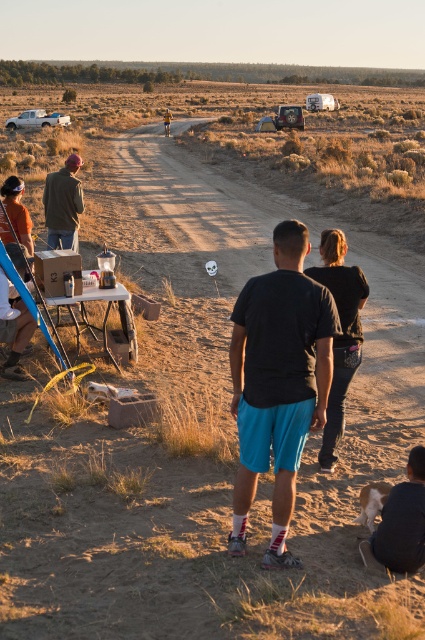
Between wooden picnic table at lower left and white matte truck at left, which one is positioned lower?

wooden picnic table at lower left

Looking at this image, is wooden picnic table at lower left taller than white matte truck at left?

No.

From the picture: Measure the distance between wooden picnic table at lower left and camera.

A distance of 22.67 feet exists between wooden picnic table at lower left and camera.

This screenshot has height=640, width=425. Find the location of `wooden picnic table at lower left`. wooden picnic table at lower left is located at coordinates (104, 314).

Does point (48, 211) lie behind point (28, 116)?

No, (48, 211) is closer to viewer.

Which is in front, point (54, 177) or point (45, 109)?

Point (54, 177) is in front.

You are a GUI agent. You are given a task and a screenshot of the screen. Output one action in this format:
    pyautogui.click(x=<x>, y=<y>)
    Task: Click on the matte green jacket at left
    
    Given the screenshot: What is the action you would take?
    pyautogui.click(x=62, y=204)

Where is `matte green jacket at left`? This screenshot has width=425, height=640. matte green jacket at left is located at coordinates (62, 204).

Between black matte shirt at center and wooden picnic table at lower left, which one has less height?

wooden picnic table at lower left

Which is above, black matte shirt at center or wooden picnic table at lower left?

wooden picnic table at lower left is higher up.

I want to click on black matte shirt at center, so click(278, 381).